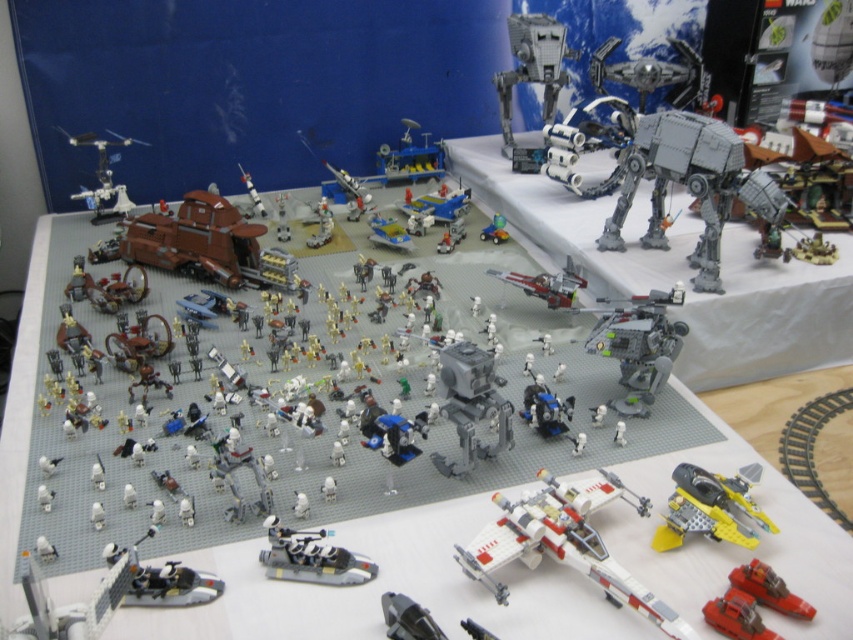
Question: Which of the following is the farthest from the observer?

Choices:
 (A) (628, 588)
 (B) (253, 198)
 (C) (312, 532)
 (D) (384, 240)

Answer: (B)

Question: Which point is closer to the camera?

Choices:
 (A) matte plastic spaceship at center
 (B) blue plastic airplane at center
 (C) shiny red plastic spaceship at center

Answer: (C)

Question: Which of the following is the farthest from the observer?

Choices:
 (A) shiny red plastic spaceship at center
 (B) translucent blue plastic spaceship at center

Answer: (B)

Question: Is shiny red plastic spaceship at center bigger than metallic silver rocket at center?

Choices:
 (A) yes
 (B) no

Answer: (A)

Question: Is shiny silver motorcycle at lower left above metallic silver helicopter at upper left?

Choices:
 (A) no
 (B) yes

Answer: (A)

Question: Is metallic silver robot at center wider than translucent green plastic toy at center?

Choices:
 (A) yes
 (B) no

Answer: (A)